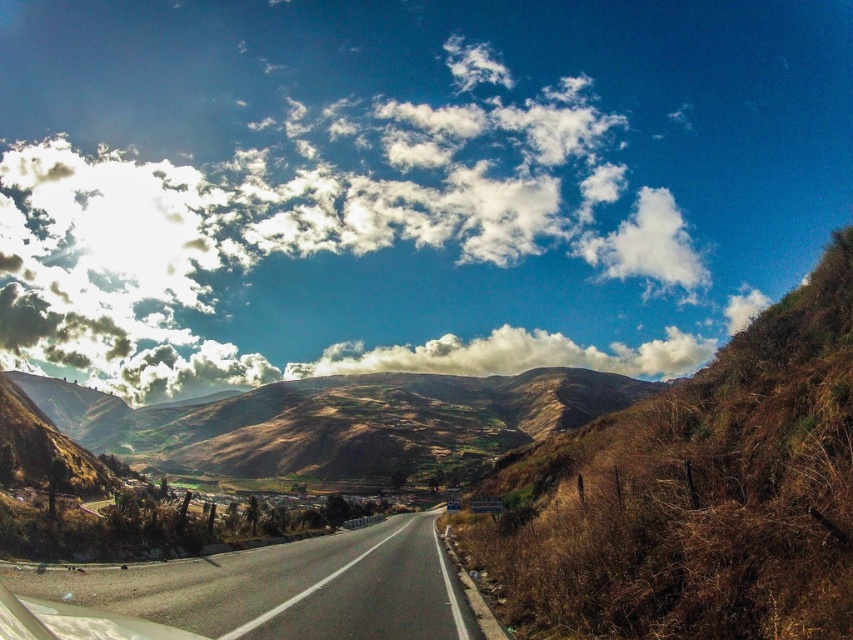
You are a hiker planning to take a photo of the cloudy sky at upper center and the grassy dirt path at lower right. Which object should you focus on first if you want both to be in sharp focus?

The grassy dirt path at lower right is behind the cloudy sky at upper center, so you should focus on the cloudy sky at upper center first to ensure both are in sharp focus.

You are a hiker planning to take a photo of the cloudy sky at upper center and the grassy dirt path at lower right. Which object occupies a larger portion of the image in terms of width?

The cloudy sky at upper center occupies a larger portion of the image in terms of width compared to the grassy dirt path at lower right.